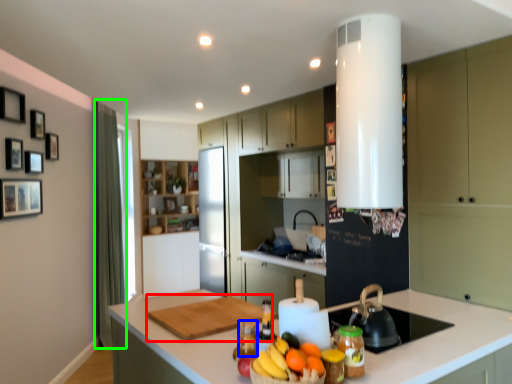
Question: Which object is the closest to the cutting board (highlighted by a red box)? Choose among these: bottle (highlighted by a blue box) or curtain (highlighted by a green box).

Choices:
 (A) bottle
 (B) curtain

Answer: (A)